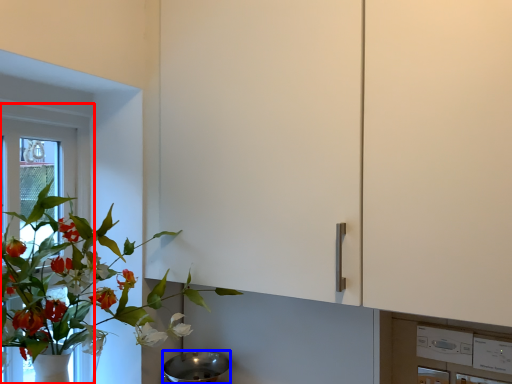
Question: Among these objects, which one is nearest to the camera, window frame (highlighted by a red box) or mixing bowl (highlighted by a blue box)?

Choices:
 (A) window frame
 (B) mixing bowl

Answer: (B)